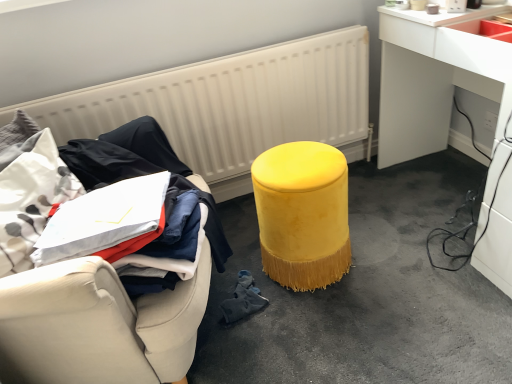
Find the location of a particular element. free location to the left of white glossy desk at right is located at coordinates (374, 227).